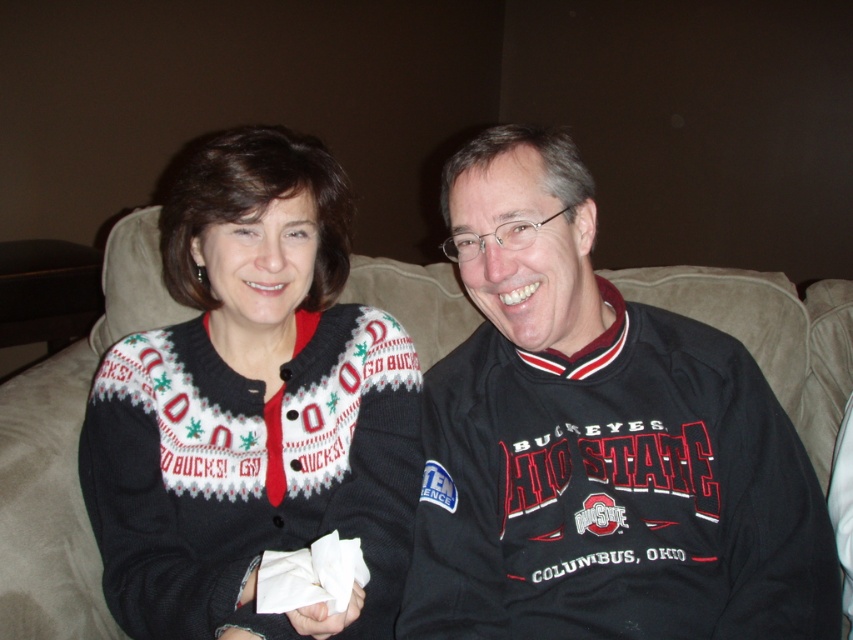
Can you confirm if black jersey at center is thinner than knit sweater at center?

In fact, black jersey at center might be wider than knit sweater at center.

Is black jersey at center below knit sweater at center?

Yes, black jersey at center is below knit sweater at center.

Between point (584, 259) and point (276, 518), which one is positioned behind?

Positioned behind is point (276, 518).

Locate an element on the screen. This screenshot has height=640, width=853. black jersey at center is located at coordinates (598, 442).

Is black jersey at center wider than suede couch at center?

Yes, black jersey at center is wider than suede couch at center.

Who is taller, black jersey at center or suede couch at center?

With more height is suede couch at center.

Does point (532, 515) come farther from viewer compared to point (59, 525)?

No, it is in front of (59, 525).

The image size is (853, 640). I want to click on black jersey at center, so click(x=598, y=442).

Is knit sweater at center thinner than suede couch at center?

No, knit sweater at center is not thinner than suede couch at center.

Between knit sweater at center and suede couch at center, which one appears on the right side from the viewer's perspective?

Positioned to the right is knit sweater at center.

Which is behind, point (267, 140) or point (85, 620)?

The point (85, 620) is behind.

Where is `knit sweater at center`? Image resolution: width=853 pixels, height=640 pixels. knit sweater at center is located at coordinates (252, 404).